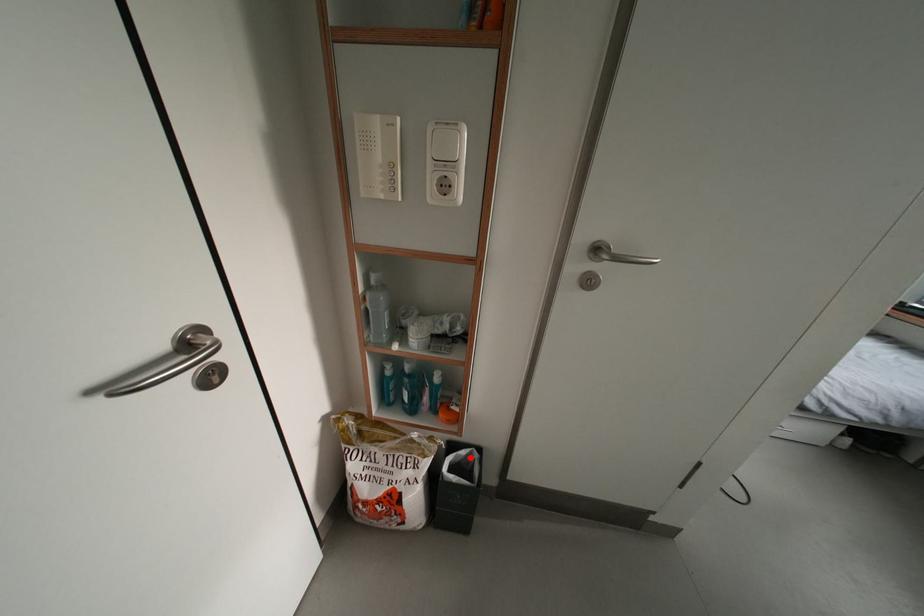
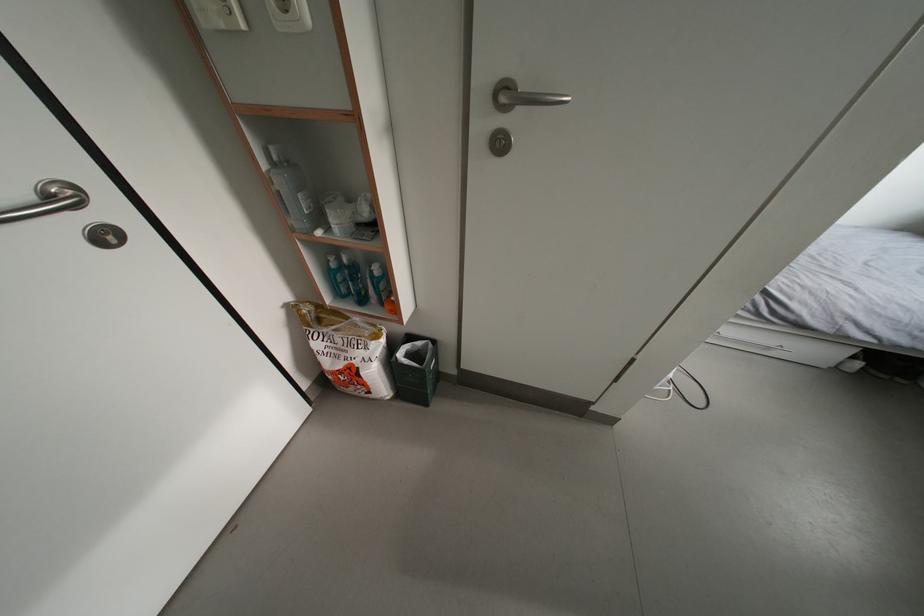
Question: A red point is marked in image1. In image2, is the corresponding 3D point closer to the camera or farther? Reply with the corresponding letter.

Choices:
 (A) The corresponding 3D point is closer.
 (B) The corresponding 3D point is farther.

Answer: (A)